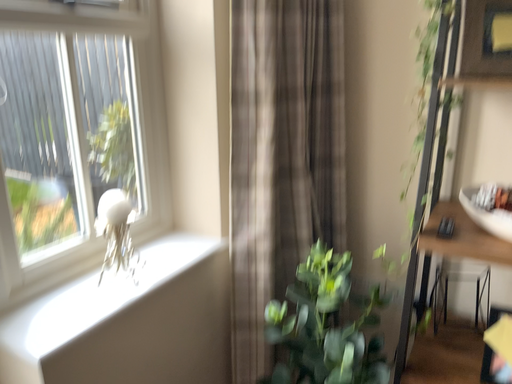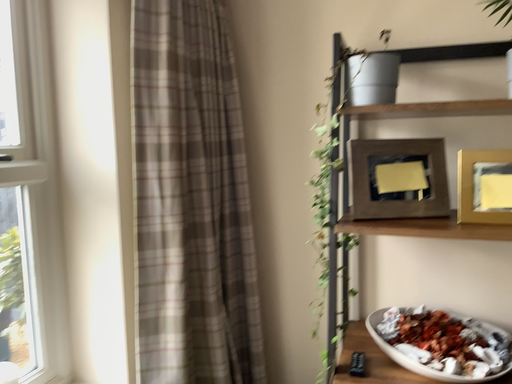
Question: Which way did the camera rotate in the video?

Choices:
 (A) rotated downward
 (B) rotated upward

Answer: (B)